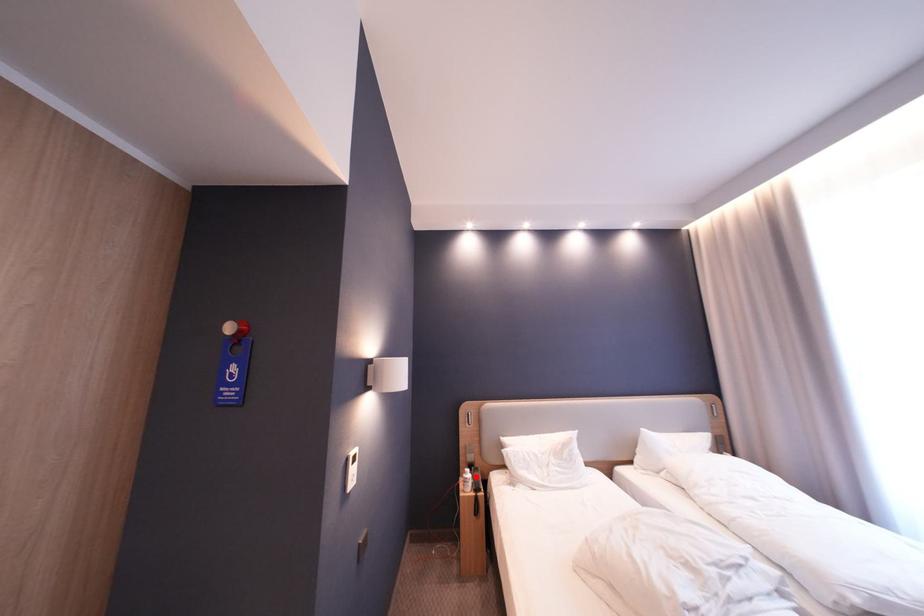
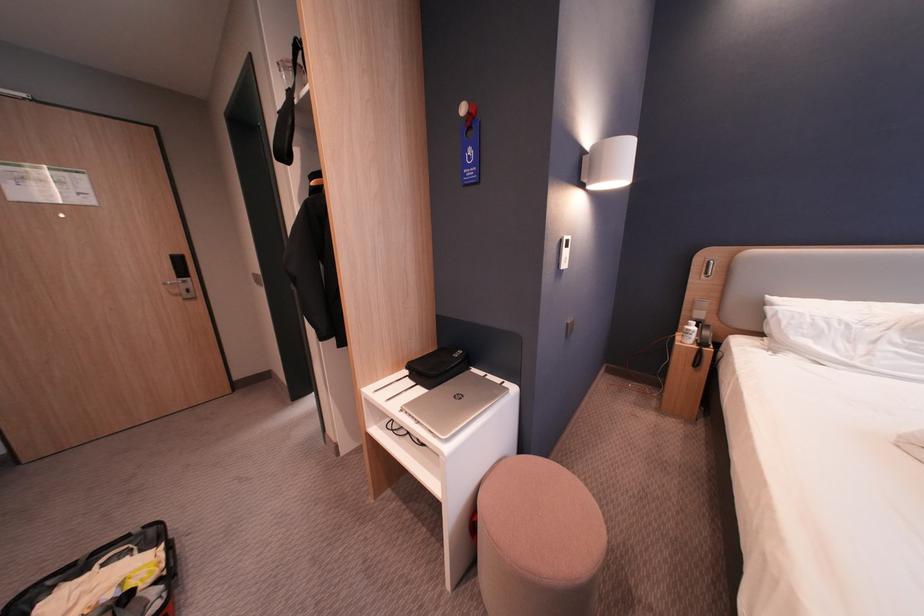
Locate, in the second image, the point that corresponds to the highlighted location in the first image.

(698, 328)